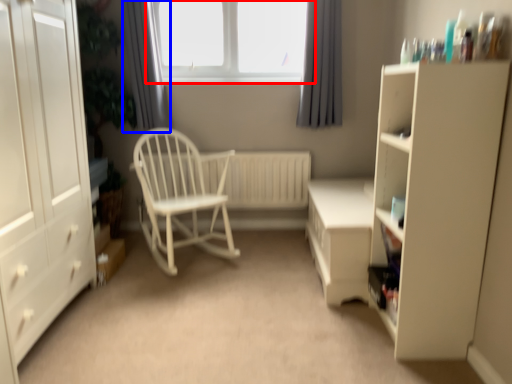
Question: Which object is closer to the camera taking this photo, window (highlighted by a red box) or curtain (highlighted by a blue box)?

Choices:
 (A) window
 (B) curtain

Answer: (B)